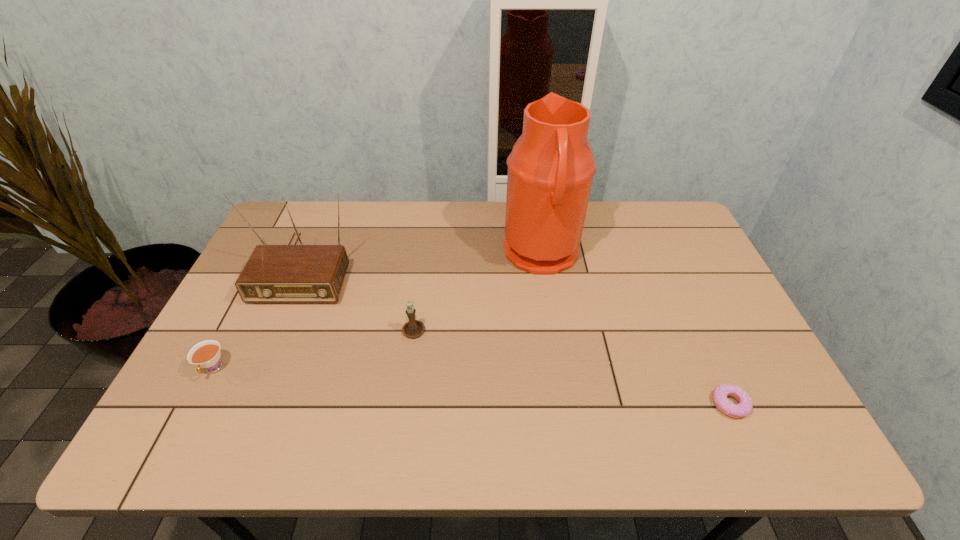
This screenshot has height=540, width=960. Find the location of `object located in the near edge section of the desktop`. object located in the near edge section of the desktop is located at coordinates (744, 407).

Identify the location of radio_receiver that is at the left edge. Image resolution: width=960 pixels, height=540 pixels. (288, 273).

Find the location of a particular element. This screenshot has width=960, height=540. teacup located at the left edge is located at coordinates (206, 354).

Image resolution: width=960 pixels, height=540 pixels. In order to click on object that is at the right edge in this screenshot , I will do `click(744, 407)`.

The height and width of the screenshot is (540, 960). I want to click on object that is at the far left corner, so click(288, 273).

At what (x,y) coordinates should I click in order to perform the action: click on object present at the near right corner. Please return your answer as a coordinate pair (x, y). The height and width of the screenshot is (540, 960). Looking at the image, I should click on (744, 407).

In the image, there is a desktop. Where is `vacant region at the far edge`? This screenshot has width=960, height=540. vacant region at the far edge is located at coordinates point(605,210).

Find the location of a particular element. This screenshot has width=960, height=540. free space at the near edge is located at coordinates (470, 425).

Locate an element on the screen. vacant point at the left edge is located at coordinates (239, 358).

In the image, there is a desktop. In order to click on free region at the right edge in this screenshot , I will do `click(713, 368)`.